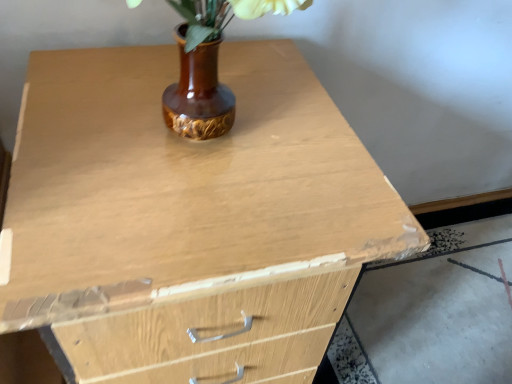
At what (x,y) coordinates should I click in order to perform the action: click on free point to the right of browny-golden ceramic vase at center. Please return your answer as a coordinate pair (x, y). The height and width of the screenshot is (384, 512). Looking at the image, I should click on (330, 160).